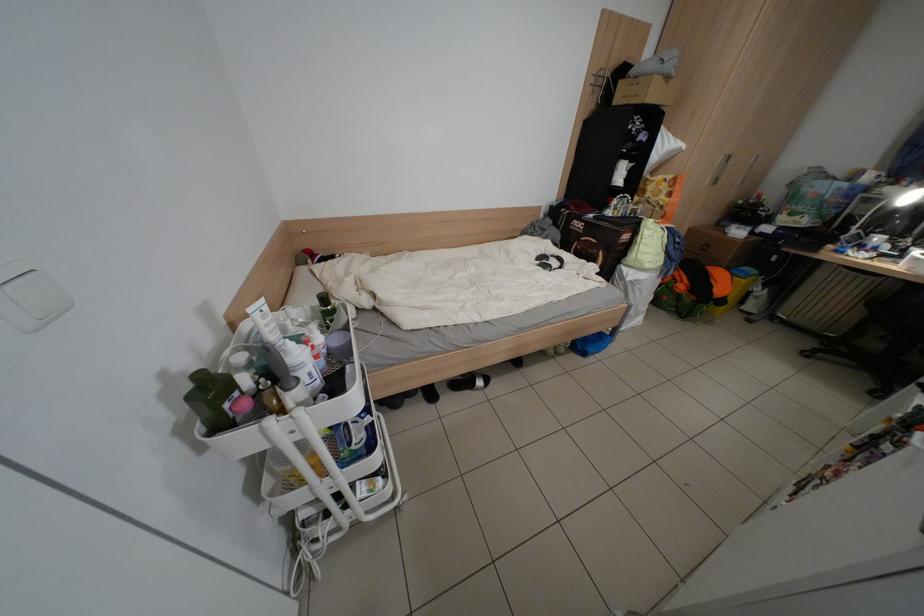
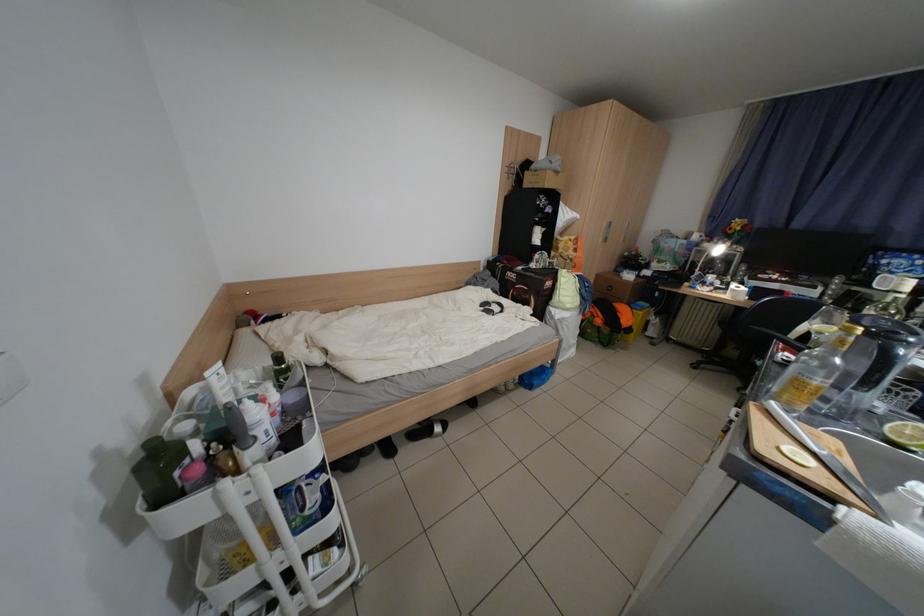
Locate, in the second image, the point that corresponds to pixel 201 399 in the first image.

(149, 471)